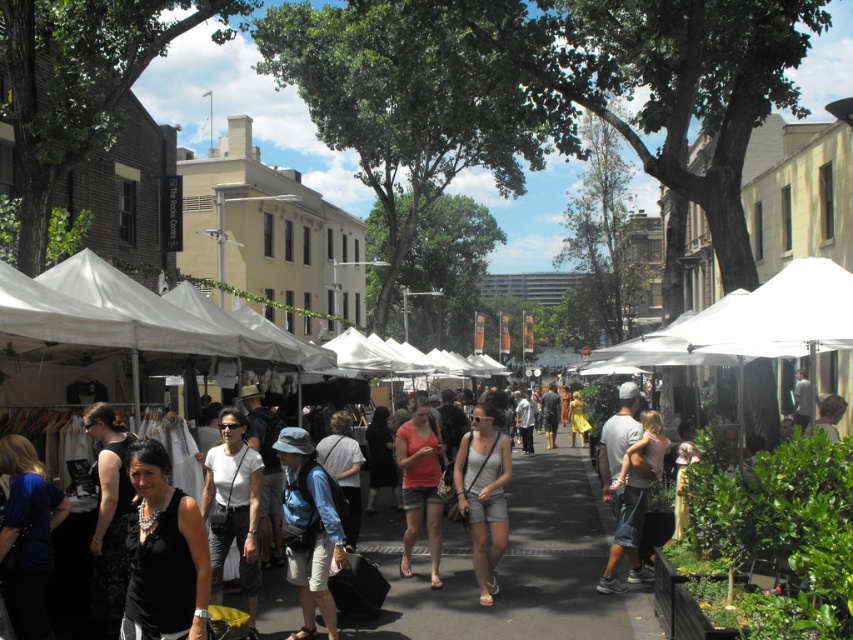
You are standing at the entrance of the market and see a point marked at coordinates (483, 493). What item is located at that point?

The point at coordinates (483, 493) corresponds to light gray denim shorts at center.

You are a vendor at the market and want to determine which item takes up more space on your stall display. You have a light gray denim shorts at center and a matte pink shirt at center. Which one requires more display space?

The matte pink shirt at center requires more display space because it is larger than the light gray denim shorts at center.